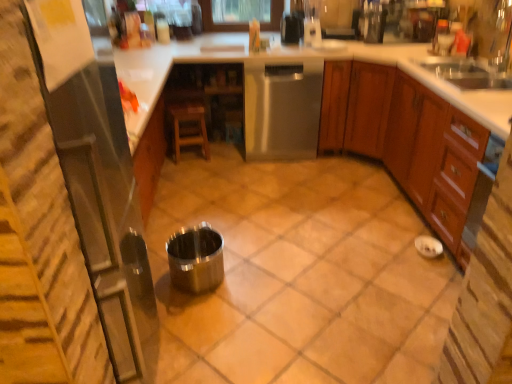
Locate an element on the screen. This screenshot has height=384, width=512. vacant point to the right of polished metallic cup at center, the fourth appliance from the back is located at coordinates (262, 288).